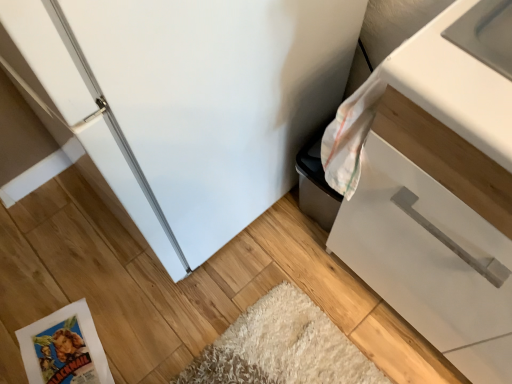
At what (x,y) coordinates should I click in order to perform the action: click on unoccupied space behind white paper comic book at lower left. Please return your answer as a coordinate pair (x, y). The height and width of the screenshot is (384, 512). Looking at the image, I should click on (76, 268).